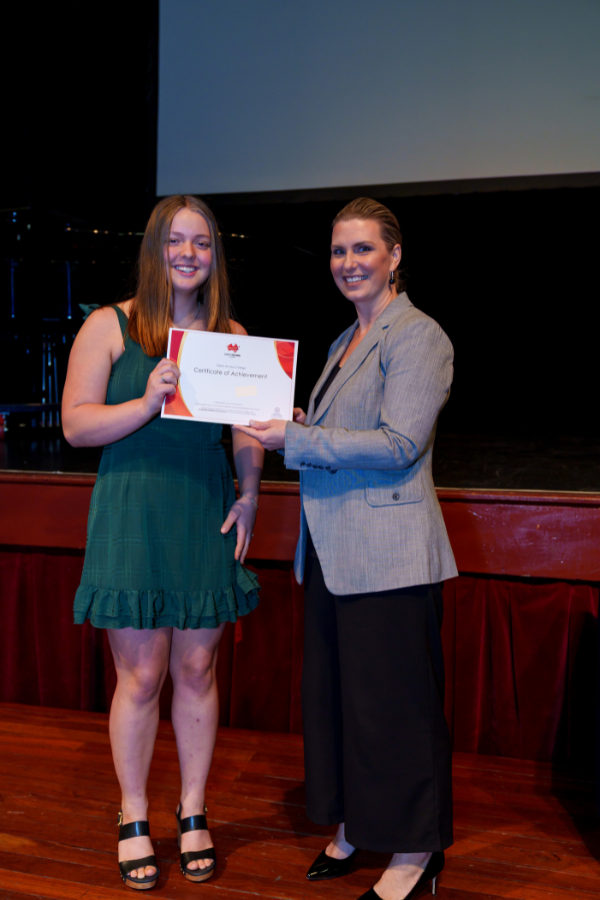
Identify the location of certificate corners. (170, 328), (296, 338), (161, 411).